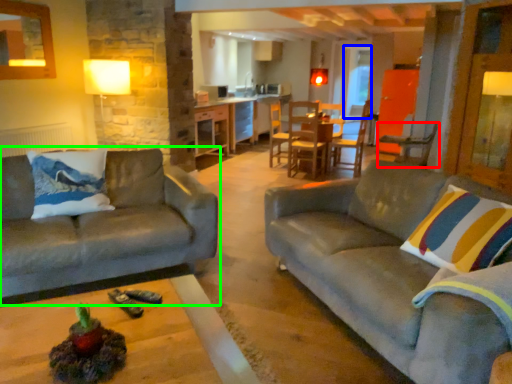
Question: Which object is positioned farthest from chair (highlighted by a red box)? Select from glass door (highlighted by a blue box) and studio couch (highlighted by a green box).

Choices:
 (A) glass door
 (B) studio couch

Answer: (B)